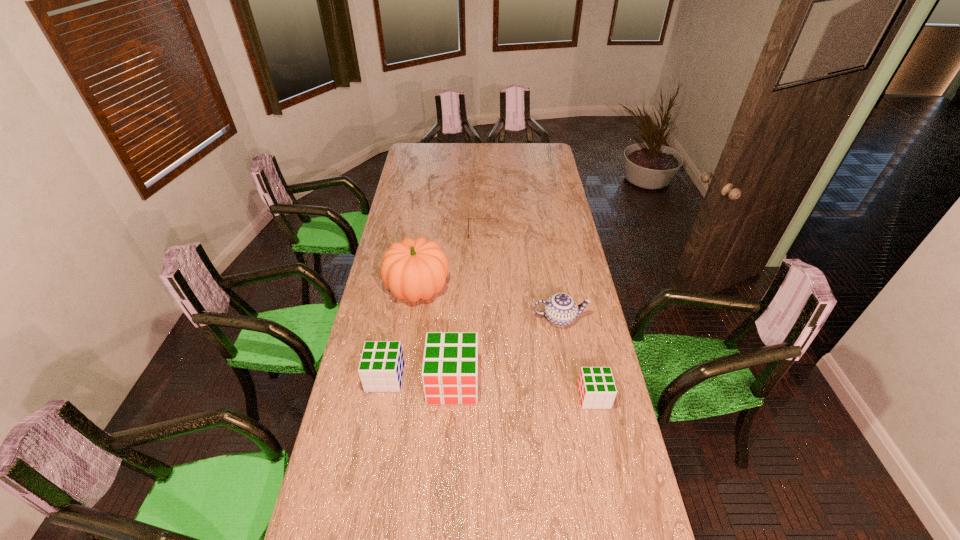
This screenshot has width=960, height=540. What are the coordinates of `vacant region between the farthest object and the tallest object` in the screenshot? It's located at (451, 261).

Where is `free space between the leftmost cube and the tallest object`? The image size is (960, 540). free space between the leftmost cube and the tallest object is located at coordinates (401, 333).

Where is `vacant point located between the tallest object and the shortest object`? Image resolution: width=960 pixels, height=540 pixels. vacant point located between the tallest object and the shortest object is located at coordinates click(x=451, y=261).

The width and height of the screenshot is (960, 540). I want to click on the third closest object to the shortest cube, so click(x=413, y=269).

Where is `object that is the fourth closest to the second tallest object`? The image size is (960, 540). object that is the fourth closest to the second tallest object is located at coordinates (596, 386).

Locate which cube is the second closest to the farthest object. Please provide its 2D coordinates. Your answer should be formatted as a tuple, i.e. [(x, y)], where the tuple contains the x and y coordinates of a point satisfying the conditions above.

[(381, 366)]

Locate an element on the screen. This screenshot has width=960, height=540. the closest cube to the tallest cube is located at coordinates (381, 366).

The width and height of the screenshot is (960, 540). I want to click on free location that satisfies the following two spatial constraints: 1. on the front-facing side of the sunglasses; 2. on the red face of the second cube from left to right, so click(x=485, y=383).

At what (x,y) coordinates should I click in order to perform the action: click on vacant space that satisfies the following two spatial constraints: 1. on the front side of the tallest object; 2. on the red face of the leftmost cube. Please return your answer as a coordinate pair (x, y). The width and height of the screenshot is (960, 540). Looking at the image, I should click on (405, 377).